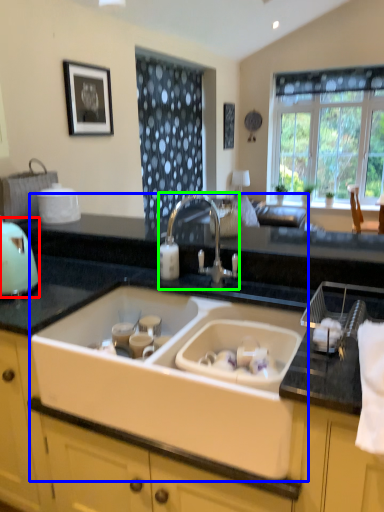
Question: Which object is positioned closest to appliance (highlighted by a red box)? Select from sink (highlighted by a blue box) and tap (highlighted by a green box).

Choices:
 (A) sink
 (B) tap

Answer: (A)